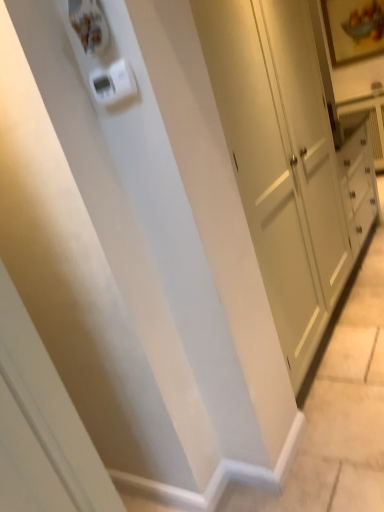
Question: Should I look upward or downward to see white plastic light switch at upper center?

Choices:
 (A) up
 (B) down

Answer: (A)

Question: Can white glossy screen door at lower left be found inside white plastic light switch at upper center?

Choices:
 (A) yes
 (B) no

Answer: (B)

Question: Is white plastic light switch at upper center bigger than white glossy screen door at lower left?

Choices:
 (A) no
 (B) yes

Answer: (A)

Question: Does white plastic light switch at upper center have a greater width compared to white glossy screen door at lower left?

Choices:
 (A) yes
 (B) no

Answer: (B)

Question: Is white plastic light switch at upper center taller than white glossy screen door at lower left?

Choices:
 (A) yes
 (B) no

Answer: (B)

Question: From a real-world perspective, is white plastic light switch at upper center below white glossy screen door at lower left?

Choices:
 (A) yes
 (B) no

Answer: (B)

Question: Is white plastic light switch at upper center touching white glossy screen door at lower left?

Choices:
 (A) no
 (B) yes

Answer: (A)

Question: Does white glossy screen door at lower left have a greater width compared to white plastic light switch at upper center?

Choices:
 (A) no
 (B) yes

Answer: (B)

Question: Considering the relative positions of white glossy screen door at lower left and white plastic light switch at upper center in the image provided, is white glossy screen door at lower left behind white plastic light switch at upper center?

Choices:
 (A) no
 (B) yes

Answer: (A)

Question: Would you say white glossy screen door at lower left contains white plastic light switch at upper center?

Choices:
 (A) no
 (B) yes

Answer: (A)

Question: Is white glossy screen door at lower left not near white plastic light switch at upper center?

Choices:
 (A) no
 (B) yes

Answer: (A)

Question: Is white glossy screen door at lower left next to white plastic light switch at upper center?

Choices:
 (A) yes
 (B) no

Answer: (B)

Question: Is white glossy screen door at lower left positioned with its back to white plastic light switch at upper center?

Choices:
 (A) no
 (B) yes

Answer: (A)

Question: From a real-world perspective, is white plastic light switch at upper center positioned above or below white glossy screen door at lower left?

Choices:
 (A) below
 (B) above

Answer: (B)